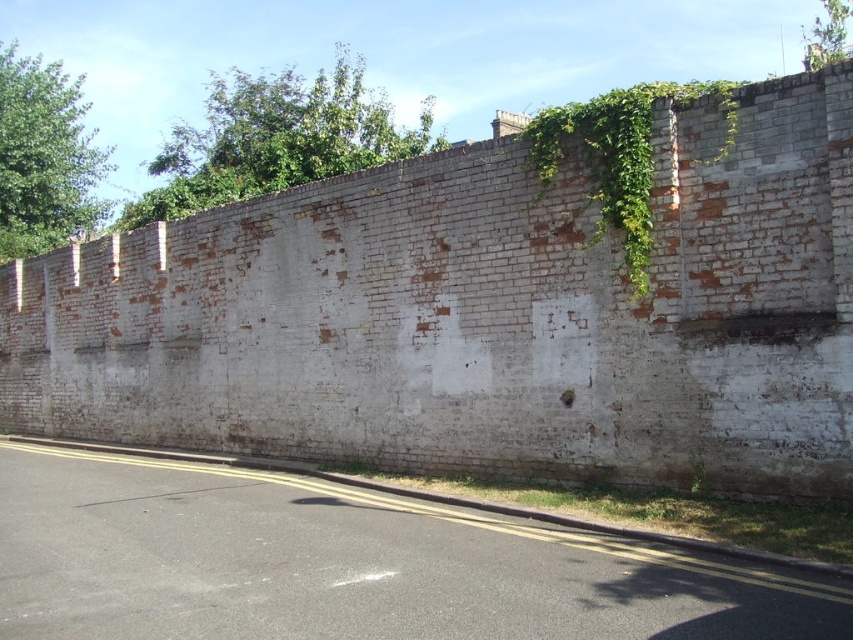
Question: Which point is closer to the camera?

Choices:
 (A) (426, 109)
 (B) (619, 145)

Answer: (B)

Question: Can you confirm if green leafy ivy at upper left is smaller than green leafy vine at upper right?

Choices:
 (A) yes
 (B) no

Answer: (A)

Question: Where is green leafy ivy at upper center located in relation to green leafy ivy at upper left in the image?

Choices:
 (A) above
 (B) below

Answer: (B)

Question: Does green leafy ivy at upper left appear on the left side of green leafy vine at upper right?

Choices:
 (A) no
 (B) yes

Answer: (B)

Question: Among these objects, which one is farthest from the camera?

Choices:
 (A) green leafy vine at upper right
 (B) green leafy ivy at upper left

Answer: (B)

Question: Which object appears closest to the camera in this image?

Choices:
 (A) green leafy ivy at upper left
 (B) green leafy vine at upper right
 (C) green leafy ivy at upper center

Answer: (B)